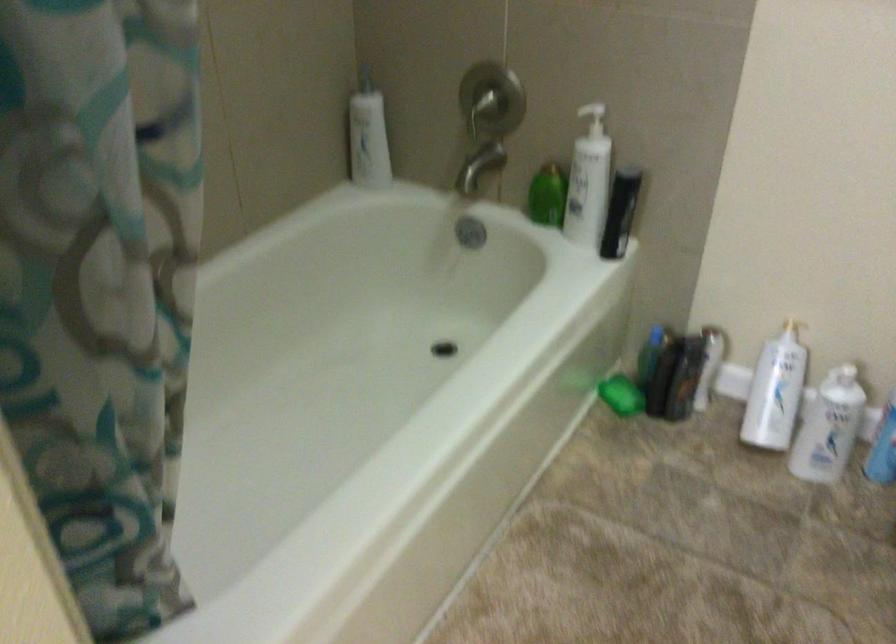
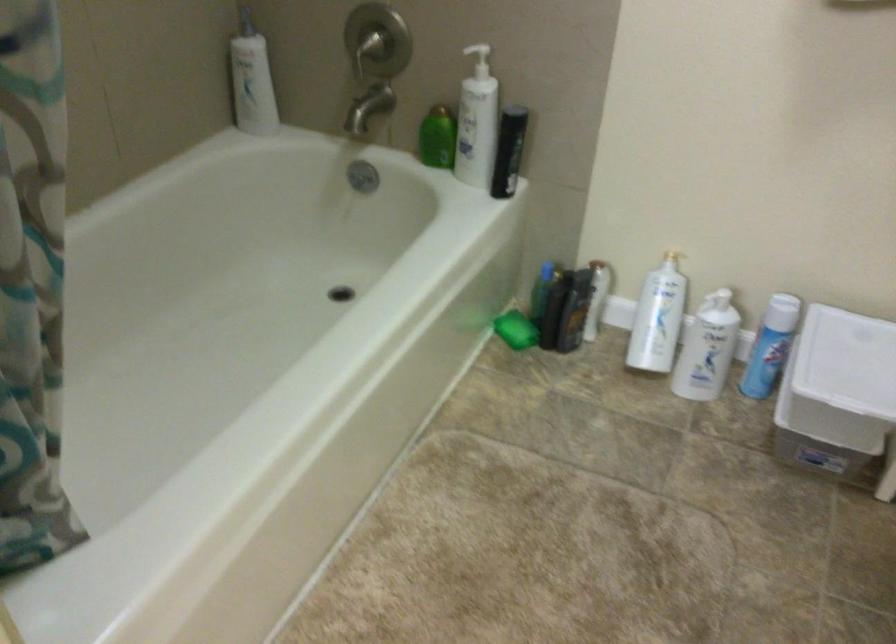
Find the pixel in the second image that matches (x=590, y=120) in the first image.

(478, 57)